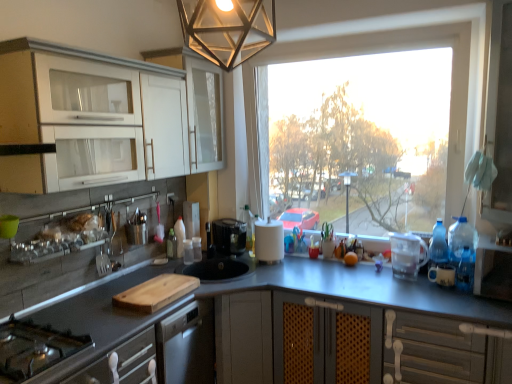
Identify the location of free spot to the left of transparent plastic container at right, which is the 3th appliance in right-to-left order. This screenshot has height=384, width=512. (374, 280).